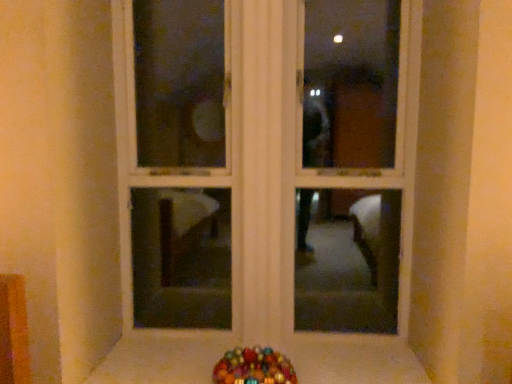
Locate an element on the screen. Image resolution: width=512 pixels, height=384 pixels. white wood window frame at center is located at coordinates tap(264, 160).

Identify the location of white wood window frame at center. (264, 160).

From a real-world perspective, is white wood window frame at center on top of glossy plastic candy at lower center?

Yes.

Which is in front, white wood window frame at center or glossy plastic candy at lower center?

Positioned in front is glossy plastic candy at lower center.

Can you see white wood window frame at center touching glossy plastic candy at lower center?

No, white wood window frame at center is not making contact with glossy plastic candy at lower center.

This screenshot has width=512, height=384. I want to click on window frame on the right side of smooth white surface at lower center, so click(264, 160).

Looking at this image, does white wood window frame at center have a greater height compared to smooth white surface at lower center?

Yes.

In terms of width, does white wood window frame at center look wider or thinner when compared to smooth white surface at lower center?

Clearly, white wood window frame at center has less width compared to smooth white surface at lower center.

Who is bigger, white wood window frame at center or smooth white surface at lower center?

Bigger between the two is white wood window frame at center.

Considering the positions of point (260, 359) and point (302, 381), is point (260, 359) closer or farther from the camera than point (302, 381)?

Point (260, 359) is positioned farther from the camera compared to point (302, 381).

Which object is further away from the camera taking this photo, glossy plastic candy at lower center or smooth white surface at lower center?

smooth white surface at lower center.

Can you confirm if glossy plastic candy at lower center is wider than smooth white surface at lower center?

In fact, glossy plastic candy at lower center might be narrower than smooth white surface at lower center.

Is glossy plastic candy at lower center looking in the opposite direction of smooth white surface at lower center?

No, glossy plastic candy at lower center is not facing the opposite direction of smooth white surface at lower center.

Which of these two, glossy plastic candy at lower center or white wood window frame at center, is thinner?

white wood window frame at center.

Is glossy plastic candy at lower center taller or shorter than white wood window frame at center?

Clearly, glossy plastic candy at lower center is shorter compared to white wood window frame at center.

From a real-world perspective, is glossy plastic candy at lower center positioned above or below white wood window frame at center?

glossy plastic candy at lower center is situated lower than white wood window frame at center in the real world.

Are smooth white surface at lower center and glossy plastic candy at lower center beside each other?

No, smooth white surface at lower center is not with glossy plastic candy at lower center.

Is smooth white surface at lower center oriented away from glossy plastic candy at lower center?

No, smooth white surface at lower center is not facing the opposite direction of glossy plastic candy at lower center.

In the scene shown: How much distance is there between smooth white surface at lower center and glossy plastic candy at lower center?

The distance of smooth white surface at lower center from glossy plastic candy at lower center is 9.42 inches.

Between smooth white surface at lower center and glossy plastic candy at lower center, which one has more height?

With more height is glossy plastic candy at lower center.

From the image's perspective, is smooth white surface at lower center on white wood window frame at center?

No, from the image's perspective, smooth white surface at lower center is not over white wood window frame at center.

Is point (180, 351) farther from camera compared to point (352, 1)?

No, it is in front of (352, 1).

Is smooth white surface at lower center facing away from white wood window frame at center?

Absolutely, smooth white surface at lower center is directed away from white wood window frame at center.

Would you say smooth white surface at lower center is to the left or to the right of white wood window frame at center in the picture?

From the image, it's evident that smooth white surface at lower center is to the left of white wood window frame at center.

This screenshot has width=512, height=384. Identify the location of window frame behind the glossy plastic candy at lower center. (264, 160).

The width and height of the screenshot is (512, 384). Find the location of `window sill below the white wood window frame at center (from a real-world perspective)`. window sill below the white wood window frame at center (from a real-world perspective) is located at coordinates (353, 359).

Which object lies nearer to the anchor point glossy plastic candy at lower center, smooth white surface at lower center or white wood window frame at center?

smooth white surface at lower center lies closer to glossy plastic candy at lower center than the other object.

Which object lies further to the anchor point glossy plastic candy at lower center, white wood window frame at center or smooth white surface at lower center?

Based on the image, white wood window frame at center appears to be further to glossy plastic candy at lower center.

Based on the photo, which object lies nearer to the anchor point smooth white surface at lower center, glossy plastic candy at lower center or white wood window frame at center?

glossy plastic candy at lower center is positioned closer to the anchor smooth white surface at lower center.

When comparing their distances from white wood window frame at center, does glossy plastic candy at lower center or smooth white surface at lower center seem further?

smooth white surface at lower center is positioned further to the anchor white wood window frame at center.

Considering their positions, is smooth white surface at lower center positioned further to white wood window frame at center than glossy plastic candy at lower center?

smooth white surface at lower center is further to white wood window frame at center.

Based on their spatial positions, is white wood window frame at center or glossy plastic candy at lower center closer to smooth white surface at lower center?

Based on the image, glossy plastic candy at lower center appears to be nearer to smooth white surface at lower center.

This screenshot has width=512, height=384. In order to click on candy between white wood window frame at center and smooth white surface at lower center in the vertical direction in this screenshot , I will do pos(254,367).